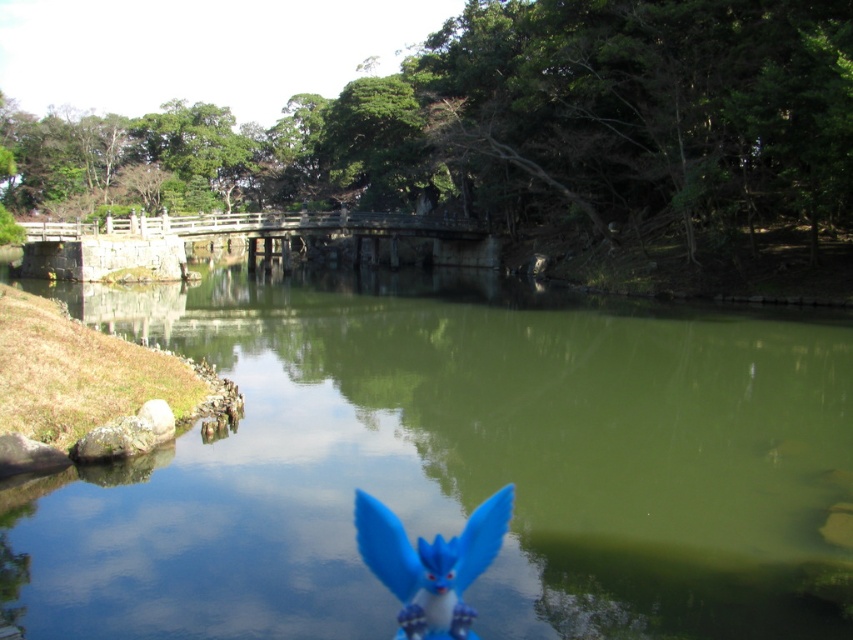
Question: From the image, what is the correct spatial relationship of green matte water at center in relation to stone bridge at center?

Choices:
 (A) above
 (B) below

Answer: (B)

Question: Which object is the farthest from the blue matte toy at center?

Choices:
 (A) stone bridge at center
 (B) green matte water at center

Answer: (A)

Question: Is green matte water at center positioned before stone bridge at center?

Choices:
 (A) yes
 (B) no

Answer: (A)

Question: Estimate the real-world distances between objects in this image. Which object is closer to the blue matte toy at center?

Choices:
 (A) stone bridge at center
 (B) green matte water at center

Answer: (B)

Question: From the image, what is the correct spatial relationship of green matte water at center in relation to stone bridge at center?

Choices:
 (A) above
 (B) below

Answer: (B)

Question: Considering the real-world distances, which object is closest to the green matte water at center?

Choices:
 (A) blue matte toy at center
 (B) stone bridge at center

Answer: (A)